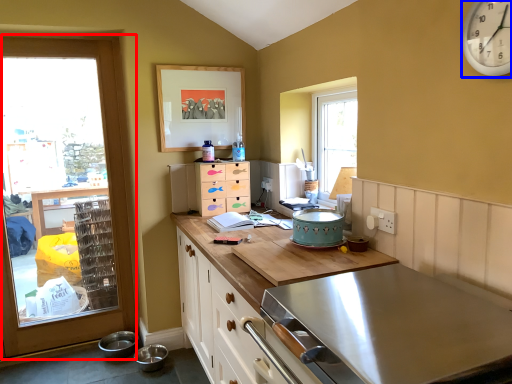
Question: Which object appears closest to the camera in this image, door (highlighted by a red box) or clock (highlighted by a blue box)?

Choices:
 (A) door
 (B) clock

Answer: (B)